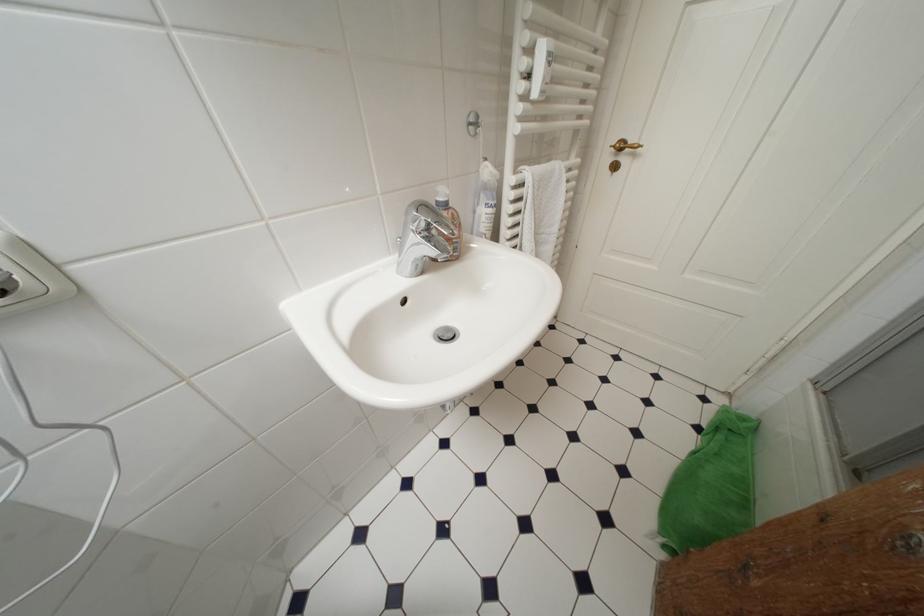
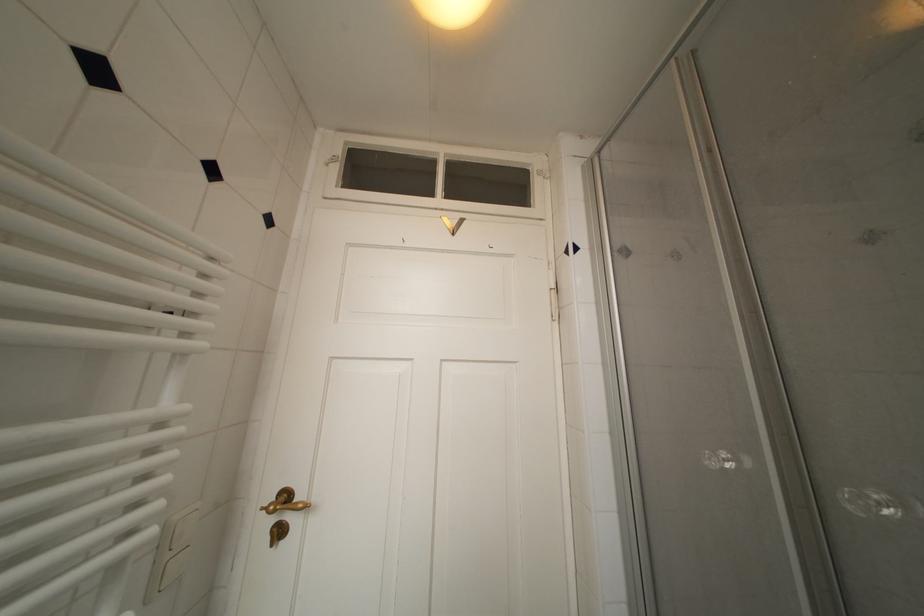
Based on the continuous images, in which direction is the camera rotating?

The rotation direction of the camera is right-up.